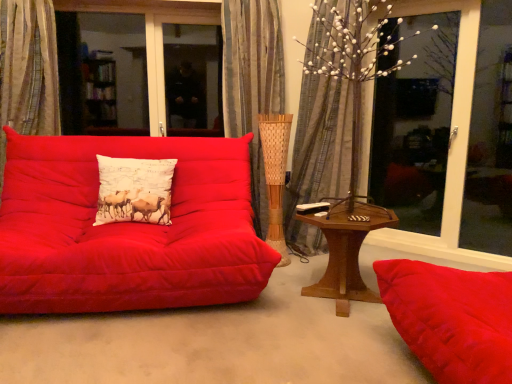
Where is `transparent glass window at upper right`? This screenshot has width=512, height=384. transparent glass window at upper right is located at coordinates (450, 149).

I want to click on wooden hexagonal table at center, so click(x=346, y=250).

Find the location of a particular element. matte red studio couch at left is located at coordinates (127, 228).

Identify the location of silky beige curtain at center, the second curtain when ordered from left to right. (252, 82).

The image size is (512, 384). I want to click on silky gray curtain at center, the 3th curtain in the left-to-right sequence, so click(x=319, y=155).

What do you see at coordinates (319, 155) in the screenshot? The height and width of the screenshot is (384, 512). I see `silky gray curtain at center, the 3th curtain in the left-to-right sequence` at bounding box center [319, 155].

Locate an element on the screen. transparent glass window at upper right is located at coordinates (450, 149).

Could silky beige curtain at center, the second curtain when ordered from left to right, be considered to be inside silky gray curtain at center, which is counted as the 1th curtain, starting from the right?

No, silky beige curtain at center, the second curtain when ordered from left to right, is not surrounded by silky gray curtain at center, which is counted as the 1th curtain, starting from the right.

Considering the positions of point (303, 156) and point (251, 196), is point (303, 156) closer or farther from the camera than point (251, 196)?

Clearly, point (303, 156) is more distant from the camera than point (251, 196).

Can you confirm if silky gray curtain at center, which is counted as the 1th curtain, starting from the right, is bigger than silky beige curtain at center, the 2th curtain when ordered from right to left?

Indeed, silky gray curtain at center, which is counted as the 1th curtain, starting from the right, has a larger size compared to silky beige curtain at center, the 2th curtain when ordered from right to left.

Is silky gray curtain at center, the 3th curtain in the left-to-right sequence, looking in the opposite direction of silky beige curtain at center, the 2th curtain when ordered from right to left?

silky gray curtain at center, the 3th curtain in the left-to-right sequence, is not turned away from silky beige curtain at center, the 2th curtain when ordered from right to left.

From a real-world perspective, between silky gray curtain at center, which is counted as the 1th curtain, starting from the right, and white printed cushion at center, who is vertically higher?

From a 3D spatial view, silky gray curtain at center, which is counted as the 1th curtain, starting from the right, is above.

Consider the image. Which is farther, [312,252] or [114,181]?

The point [312,252] is farther.

Are silky gray curtain at center, which is counted as the 1th curtain, starting from the right, and white printed cushion at center making contact?

They are not placed beside each other.

Are transparent glass window at upper right and matte red studio couch at left far apart?

That's right, there is a large distance between transparent glass window at upper right and matte red studio couch at left.

From a real-world perspective, between transparent glass window at upper right and matte red studio couch at left, who is vertically lower?

matte red studio couch at left is physically lower.

From the image's perspective, does transparent glass window at upper right appear lower than matte red studio couch at left?

Actually, transparent glass window at upper right appears above matte red studio couch at left in the image.

Choose the correct answer: Is transparent glass window at upper right inside matte red studio couch at left or outside it?

transparent glass window at upper right is not inside matte red studio couch at left, it's outside.

Considering the sizes of objects matte red studio couch at left and wooden hexagonal table at center in the image provided, who is thinner, matte red studio couch at left or wooden hexagonal table at center?

With smaller width is wooden hexagonal table at center.

Is matte red studio couch at left oriented away from wooden hexagonal table at center?

No.

This screenshot has height=384, width=512. In the image, there is a matte red studio couch at left. What are the coordinates of `table below it (from the image's perspective)` in the screenshot? It's located at (346, 250).

From a real-world perspective, is wooden hexagonal table at center above or below textured beige curtain at left, arranged as the first curtain when viewed from the left?

Clearly, from a real-world perspective, wooden hexagonal table at center is below textured beige curtain at left, arranged as the first curtain when viewed from the left.

Which is in front, point (355, 249) or point (27, 6)?

Point (355, 249)

Which of these two, wooden hexagonal table at center or textured beige curtain at left, arranged as the first curtain when viewed from the left, is smaller?

Smaller between the two is wooden hexagonal table at center.

Image resolution: width=512 pixels, height=384 pixels. I want to click on table on the right side of textured beige curtain at left, arranged as the first curtain when viewed from the left, so click(x=346, y=250).

Does wooden hexagonal table at center have a larger size compared to silky beige curtain at center, the 2th curtain when ordered from right to left?

No, wooden hexagonal table at center is not bigger than silky beige curtain at center, the 2th curtain when ordered from right to left.

From a real-world perspective, count 3rd curtains upward from the wooden hexagonal table at center and point to it. Please provide its 2D coordinates.

[(252, 82)]

Measure the distance between wooden hexagonal table at center and silky beige curtain at center, the 2th curtain when ordered from right to left.

A distance of 3.39 feet exists between wooden hexagonal table at center and silky beige curtain at center, the 2th curtain when ordered from right to left.

From a real-world perspective, is textured beige curtain at left, the third curtain when ordered from right to left, physically located above or below transparent glass window at upper right?

Clearly, from a real-world perspective, textured beige curtain at left, the third curtain when ordered from right to left, is above transparent glass window at upper right.

Can you confirm if textured beige curtain at left, the third curtain when ordered from right to left, is smaller than transparent glass window at upper right?

Yes, textured beige curtain at left, the third curtain when ordered from right to left, is smaller than transparent glass window at upper right.

Is textured beige curtain at left, the third curtain when ordered from right to left, to the left of transparent glass window at upper right from the viewer's perspective?

Correct, you'll find textured beige curtain at left, the third curtain when ordered from right to left, to the left of transparent glass window at upper right.

From the silky gray curtain at center, which is counted as the 1th curtain, starting from the right, count the 1st curtain to the left and point to it. Please provide its 2D coordinates.

[(252, 82)]

From a real-world perspective, starting from the white printed cushion at center, which curtain is the 1st one vertically above it? Please provide its 2D coordinates.

[(319, 155)]

Looking at the image, which one is located further to transparent glass window at upper right, matte red studio couch at left or wooden hexagonal table at center?

matte red studio couch at left is positioned further to the anchor transparent glass window at upper right.

Based on their spatial positions, is wooden hexagonal table at center or matte red studio couch at left further from silky beige curtain at center, the 2th curtain when ordered from right to left?

wooden hexagonal table at center is further to silky beige curtain at center, the 2th curtain when ordered from right to left.

In the scene shown: Considering their positions, is textured beige curtain at left, the third curtain when ordered from right to left, positioned further to silky beige curtain at center, the 2th curtain when ordered from right to left, than white printed cushion at center?

The object further to silky beige curtain at center, the 2th curtain when ordered from right to left, is textured beige curtain at left, the third curtain when ordered from right to left.

In the scene shown: Based on their spatial positions, is white printed cushion at center or transparent glass window at upper right further from wooden hexagonal table at center?

The object further to wooden hexagonal table at center is white printed cushion at center.

Looking at the image, which one is located further to transparent glass window at upper right, wooden hexagonal table at center or silky gray curtain at center, the 3th curtain in the left-to-right sequence?

wooden hexagonal table at center lies further to transparent glass window at upper right than the other object.

Considering their positions, is transparent glass window at upper right positioned further to silky gray curtain at center, which is counted as the 1th curtain, starting from the right, than textured beige curtain at left, arranged as the first curtain when viewed from the left?

The object further to silky gray curtain at center, which is counted as the 1th curtain, starting from the right, is textured beige curtain at left, arranged as the first curtain when viewed from the left.

Looking at the image, which one is located closer to white printed cushion at center, matte red studio couch at left or textured beige curtain at left, arranged as the first curtain when viewed from the left?

The object closer to white printed cushion at center is matte red studio couch at left.

Based on their spatial positions, is silky gray curtain at center, which is counted as the 1th curtain, starting from the right, or matte red studio couch at left further from textured beige curtain at left, arranged as the first curtain when viewed from the left?

Among the two, silky gray curtain at center, which is counted as the 1th curtain, starting from the right, is located further to textured beige curtain at left, arranged as the first curtain when viewed from the left.

This screenshot has width=512, height=384. In order to click on table between silky beige curtain at center, the second curtain when ordered from left to right, and transparent glass window at upper right from left to right in this screenshot , I will do `click(346, 250)`.

Find the location of a particular element. The image size is (512, 384). pillow between matte red studio couch at left and transparent glass window at upper right is located at coordinates (134, 190).

This screenshot has height=384, width=512. I want to click on pillow located between textured beige curtain at left, the third curtain when ordered from right to left, and silky beige curtain at center, the 2th curtain when ordered from right to left, in the left-right direction, so click(x=134, y=190).

Where is `pillow located between textured beige curtain at left, the third curtain when ordered from right to left, and transparent glass window at upper right in the left-right direction`? pillow located between textured beige curtain at left, the third curtain when ordered from right to left, and transparent glass window at upper right in the left-right direction is located at coordinates (134, 190).